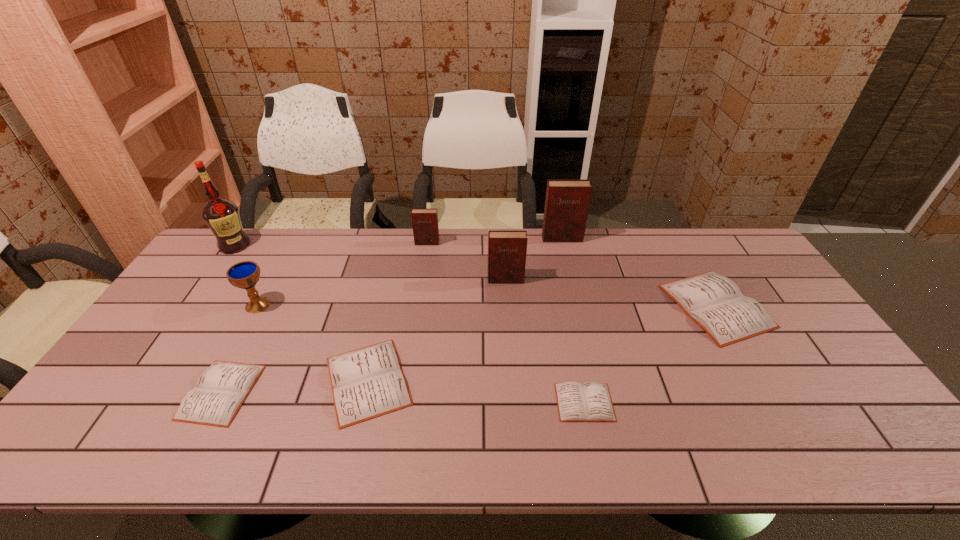
I want to click on vacant region at the far edge of the desktop, so click(x=297, y=232).

In the image, there is a desktop. Identify the location of vacant space at the near edge. The height and width of the screenshot is (540, 960). (517, 427).

Where is `free space at the left edge of the desktop`? The width and height of the screenshot is (960, 540). free space at the left edge of the desktop is located at coordinates (112, 402).

What are the coordinates of `blank space at the right edge` in the screenshot? It's located at (817, 343).

The image size is (960, 540). In order to click on vacant area at the far left corner of the desktop in this screenshot , I will do `click(263, 237)`.

This screenshot has width=960, height=540. I want to click on vacant position at the near left corner of the desktop, so click(x=92, y=441).

Locate an element on the screen. The image size is (960, 540). free space at the far right corner is located at coordinates (731, 269).

Image resolution: width=960 pixels, height=540 pixels. I want to click on free space between the chalice and the second shortest diary, so click(240, 349).

Identify the location of vacant area that lies between the rightmost reddish-brown diary and the fourth shortest object. (639, 272).

This screenshot has height=540, width=960. What are the coordinates of `blank region between the biggest white diary and the seventh tallest object` in the screenshot? It's located at (542, 343).